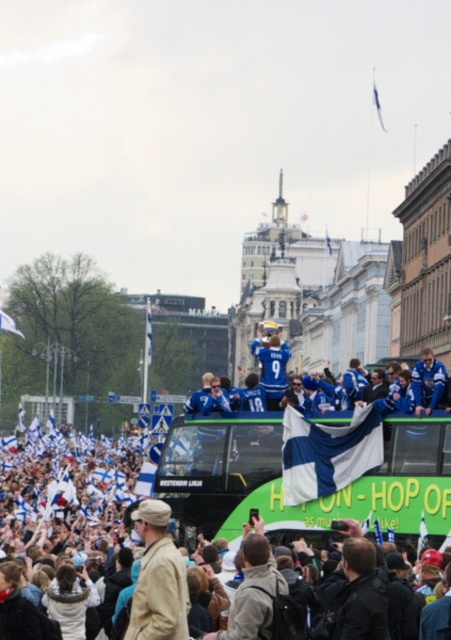
Question: Does white fabric crowd at lower center appear over green fabric-covered bus at center?

Choices:
 (A) no
 (B) yes

Answer: (A)

Question: Which point is closer to the camera?

Choices:
 (A) (68, 493)
 (B) (184, 564)
 (C) (390, 412)
 (D) (248, 435)

Answer: (B)

Question: Does green fabric-covered bus at center appear on the right side of blue jersey at center?

Choices:
 (A) yes
 (B) no

Answer: (B)

Question: Which of the following is the closest to the observer?

Choices:
 (A) blue jersey at center
 (B) green fabric-covered bus at center
 (C) white fabric crowd at lower center
 (D) tan fabric jacket at center

Answer: (D)

Question: Is white fabric crowd at lower center wider than blue jersey at center?

Choices:
 (A) no
 (B) yes

Answer: (B)

Question: Which of the following is the farthest from the observer?

Choices:
 (A) blue jersey at center
 (B) white fabric crowd at lower center

Answer: (A)